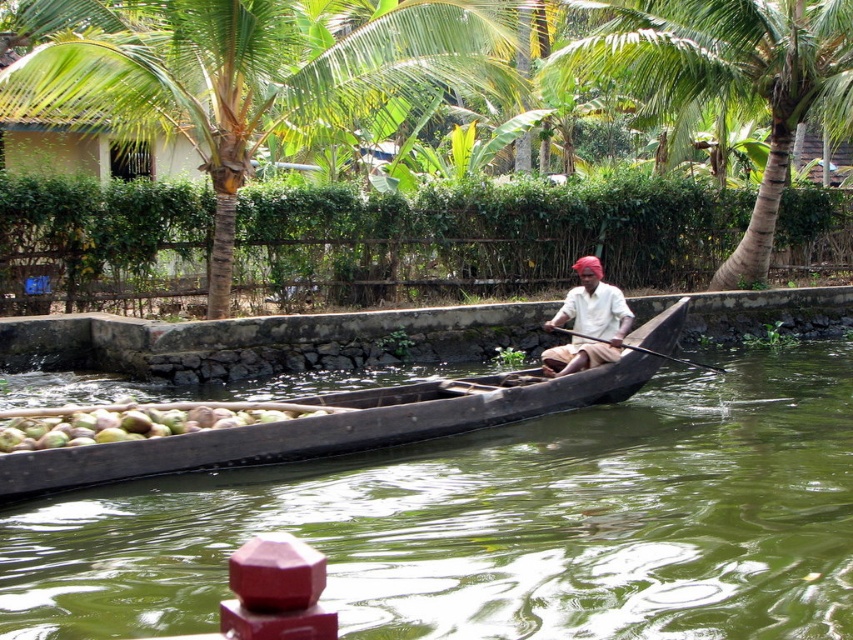
Question: Which object is closer to the camera taking this photo?

Choices:
 (A) green leafy coconut tree at upper center
 (B) light brown wooden boat at center
 (C) wooden canoe at center

Answer: (C)

Question: Among these points, which one is farthest from the camera?

Choices:
 (A) (656, 380)
 (B) (628, 330)

Answer: (A)

Question: Considering the relative positions of green leafy coconut tree at center and light brown wooden boat at center in the image provided, where is green leafy coconut tree at center located with respect to light brown wooden boat at center?

Choices:
 (A) left
 (B) right

Answer: (A)

Question: Which is nearer to the green leafy coconut tree at center?

Choices:
 (A) greenish-brown water at center
 (B) light brown wooden boat at center
 (C) green leafy coconut tree at upper center

Answer: (B)

Question: Does green rough coconut at center lie in front of black wood paddle at center?

Choices:
 (A) yes
 (B) no

Answer: (A)

Question: Can you confirm if green rough coconut at center is wider than light brown wooden boat at center?

Choices:
 (A) no
 (B) yes

Answer: (B)